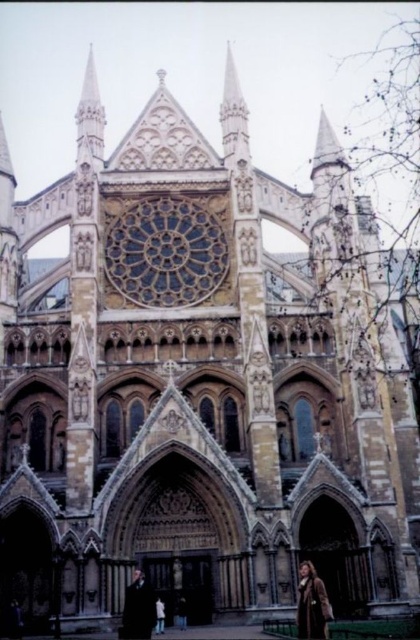
You are standing in front of Westminster Abbey and want to take a photo. You notice two points on the facade marked as point 1 at coordinates (76, 122) and point 2 at coordinates (325, 614). Which point is closer to your camera?

Point 1 at coordinates (76, 122) is closer to the camera than point 2 at coordinates (325, 614) because it is further to the camera than the latter.